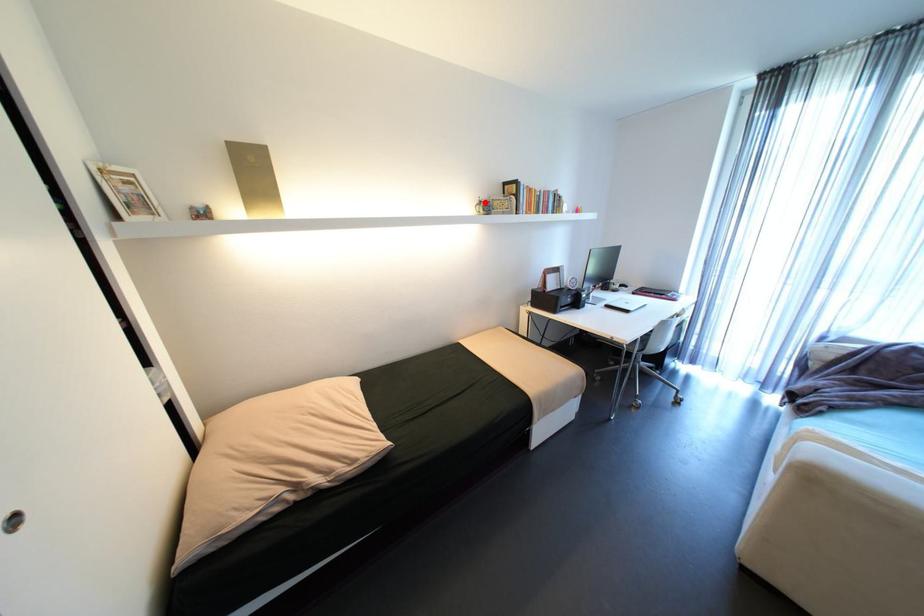
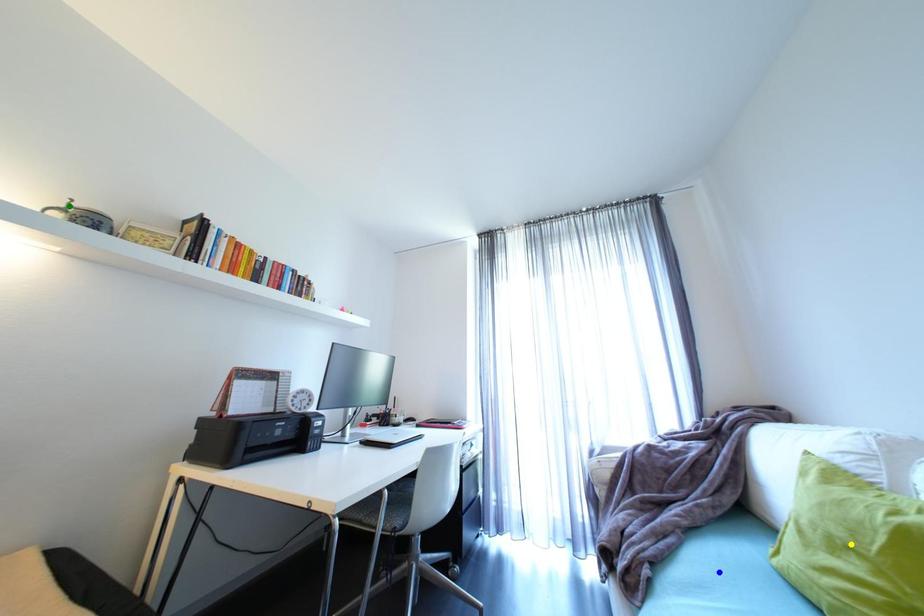
Question: I am providing you with two images of the same scene from different viewpoints. A red point is marked on the first image. You are given multiple points on the second image. Which point in image 2 represents the same 3d spot as the red point in image 1?

Choices:
 (A) yellow point
 (B) green point
 (C) blue point

Answer: (B)